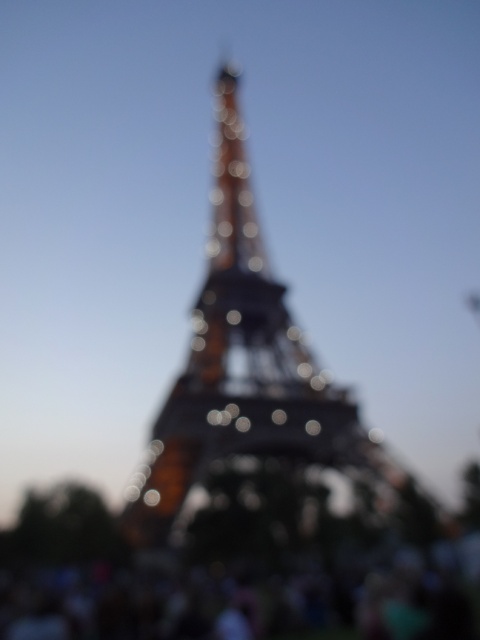
You are a photographer trying to capture the Eiffel Tower. You notice the metallic structure at center and the blurred crowd at lower center in your viewfinder. Which object is closer to the camera based on their positions?

The metallic structure at center is positioned over the blurred crowd at lower center, meaning it is closer to the camera.

You are a photographer standing at the blurred crowd at lower center, wanting to take a clear photo of the metallic structure at center. The camera requires a minimum distance of 80 feet to focus properly. Can you take a clear photo from your current position?

The metallic structure at center is 77.09 feet from blurred crowd at lower center. Since the required minimum distance is 80 feet, you are too close to take a clear photo.